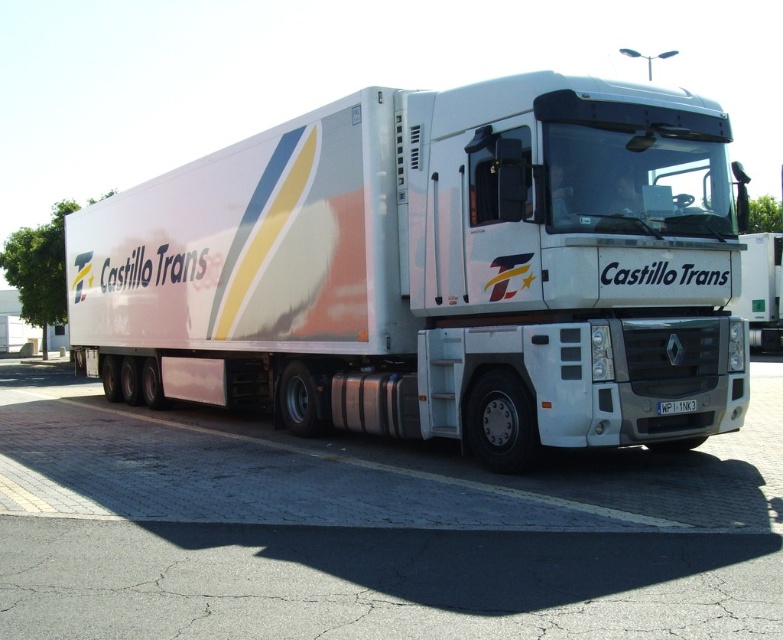
Question: Among these points, which one is farthest from the camera?

Choices:
 (A) (568, 236)
 (B) (769, 298)

Answer: (B)

Question: Is white glossy trailer truck at center closer to the viewer compared to white plastic license plate at center?

Choices:
 (A) yes
 (B) no

Answer: (A)

Question: In this image, where is white glossy truck at center located relative to white plastic license plate at center?

Choices:
 (A) left
 (B) right

Answer: (B)

Question: Which of the following is the farthest from the observer?

Choices:
 (A) (664, 413)
 (B) (767, 339)
 (C) (608, 168)

Answer: (B)

Question: Based on their relative distances, which object is nearer to the white plastic license plate at center?

Choices:
 (A) white glossy trailer truck at center
 (B) white glossy truck at center

Answer: (A)

Question: Does white glossy trailer truck at center have a larger size compared to white plastic license plate at center?

Choices:
 (A) yes
 (B) no

Answer: (A)